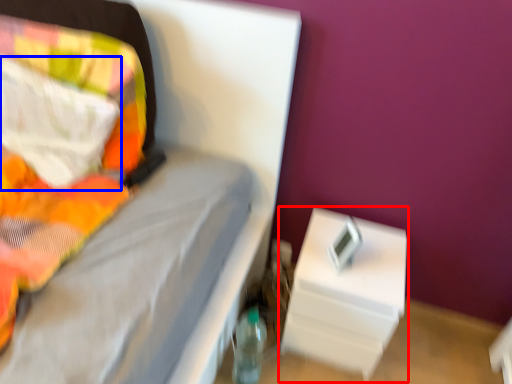
Question: Which of the following is the farthest to the observer, nightstand (highlighted by a red box) or pillow (highlighted by a blue box)?

Choices:
 (A) nightstand
 (B) pillow

Answer: (A)